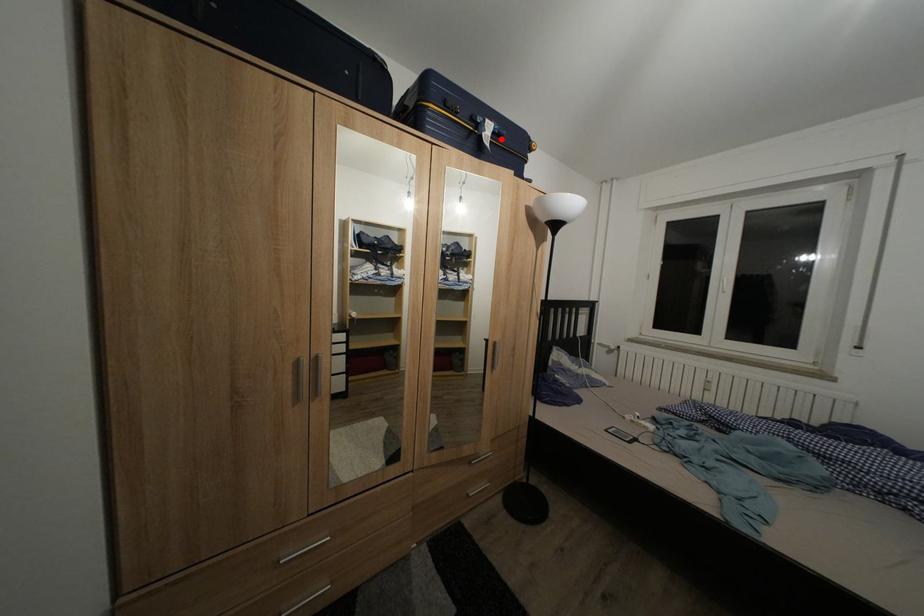
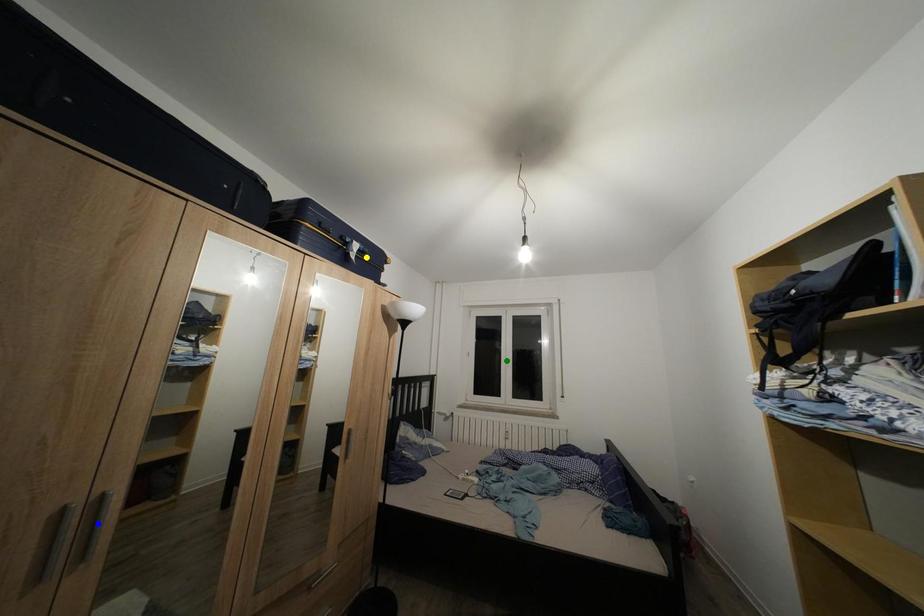
Question: I am providing you with two images of the same scene from different viewpoints. A red point is marked on the first image. You are given multiple points on the second image. Which point in image 2 represents the same 3d spot as the red point in image 1?

Choices:
 (A) blue point
 (B) green point
 (C) yellow point

Answer: (C)